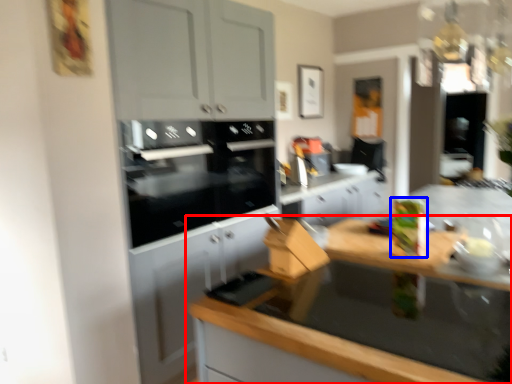
Question: Which of the following is the farthest to the observer, countertop (highlighted by a red box) or appliance (highlighted by a blue box)?

Choices:
 (A) countertop
 (B) appliance

Answer: (B)